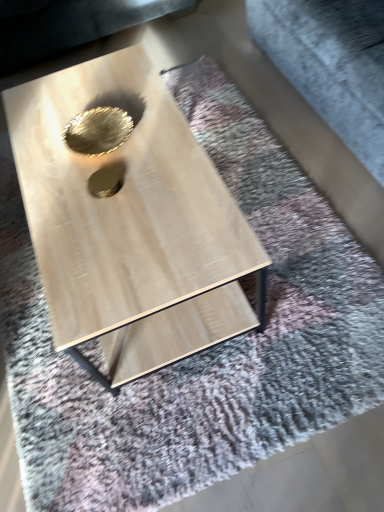
This screenshot has height=512, width=384. I want to click on vacant space to the left of gold metallic hole at center, which appears as the 2th hole when ordered from the bottom, so pos(44,151).